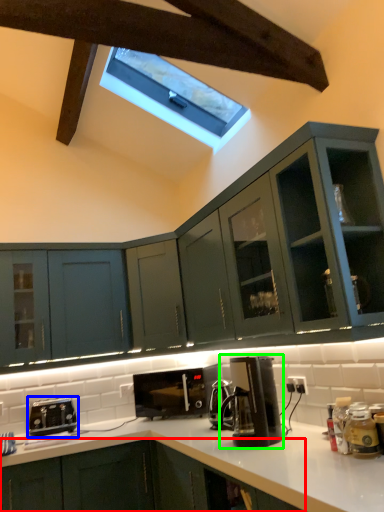
Question: Which object is the farthest from cabinetry (highlighted by a red box)? Choose among these: toaster (highlighted by a blue box) or kitchen appliance (highlighted by a green box).

Choices:
 (A) toaster
 (B) kitchen appliance

Answer: (A)